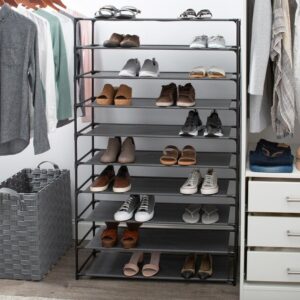
Find the location of `bottom row of shoes`. bottom row of shoes is located at coordinates (132, 264), (153, 264), (188, 266), (203, 267).